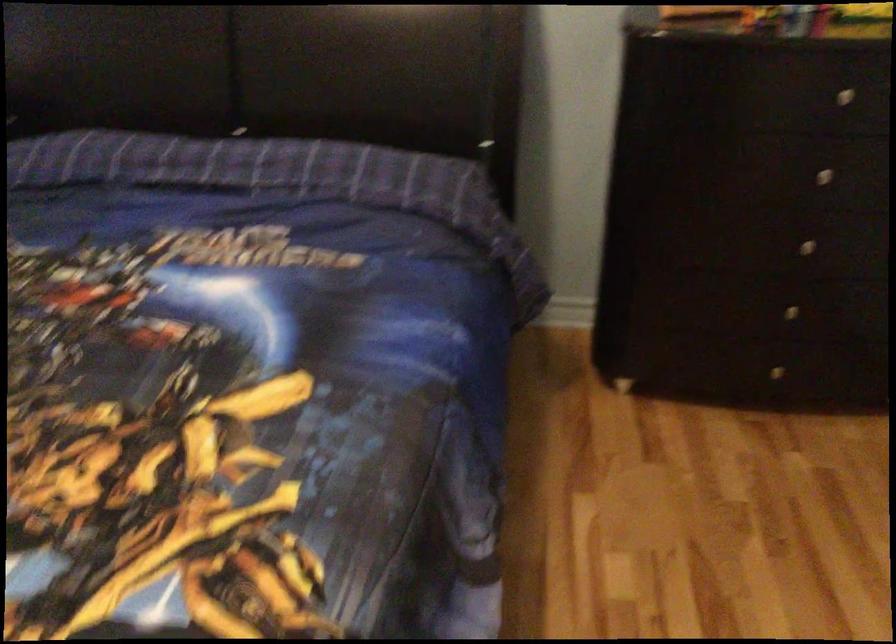
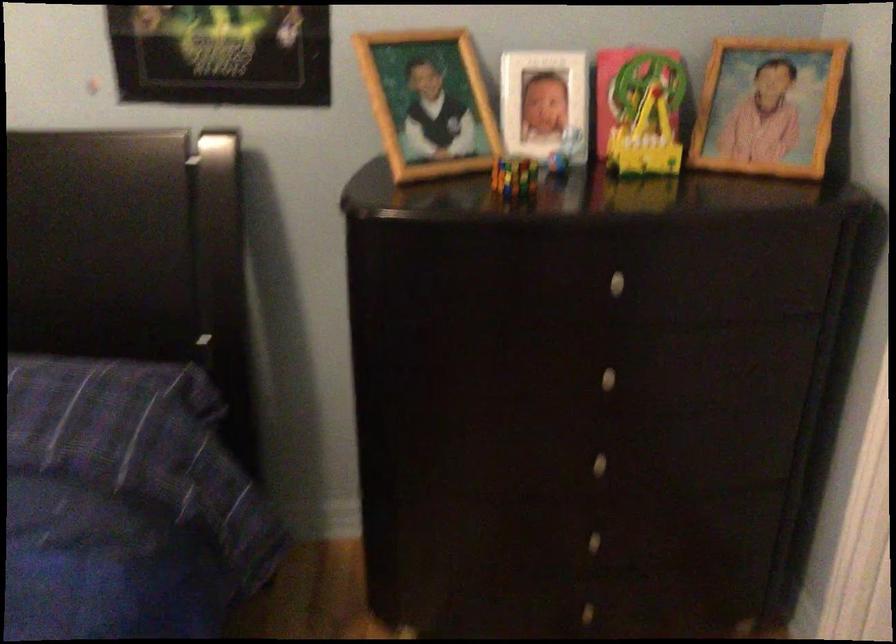
Question: The first image is from the beginning of the video and the second image is from the end. How did the camera likely rotate when shooting the video?

Choices:
 (A) Left
 (B) Right
 (C) Up
 (D) Down

Answer: (C)